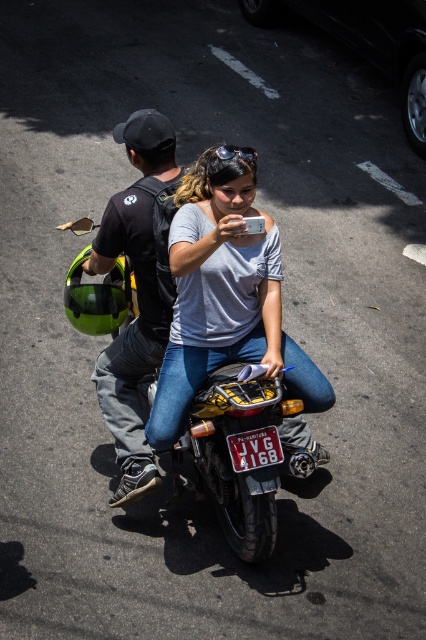
Question: Which is nearer to the black matte helmet at left?

Choices:
 (A) matte gray shirt at center
 (B) metallic yellow motorcycle at center

Answer: (A)

Question: Which point is farther from the camera taking this photo?

Choices:
 (A) (267, 464)
 (B) (106, 218)
 (C) (212, 147)

Answer: (B)

Question: Does matte gray shirt at center have a smaller size compared to black matte helmet at left?

Choices:
 (A) yes
 (B) no

Answer: (B)

Question: Does matte gray shirt at center appear over metallic yellow motorcycle at center?

Choices:
 (A) yes
 (B) no

Answer: (A)

Question: Which of the following is the farthest from the observer?

Choices:
 (A) (224, 410)
 (B) (143, 333)
 (C) (310, 440)

Answer: (C)

Question: Is the position of black matte helmet at left less distant than that of matte black goggles at center?

Choices:
 (A) yes
 (B) no

Answer: (B)